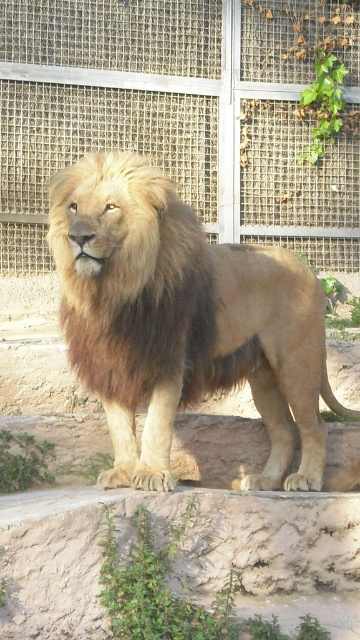
Question: Among these objects, which one is nearest to the camera?

Choices:
 (A) golden fur lion at center
 (B) metal mesh fence at upper center

Answer: (A)

Question: Does metal mesh fence at upper center have a larger size compared to golden fur lion at center?

Choices:
 (A) no
 (B) yes

Answer: (A)

Question: Can you confirm if metal mesh fence at upper center is positioned to the right of golden fur lion at center?

Choices:
 (A) yes
 (B) no

Answer: (B)

Question: Among these points, which one is nearest to the camera?

Choices:
 (A) (246, 92)
 (B) (312, 419)

Answer: (B)

Question: Does metal mesh fence at upper center appear on the left side of golden fur lion at center?

Choices:
 (A) yes
 (B) no

Answer: (A)

Question: Which point appears closest to the camera in this image?

Choices:
 (A) (144, 468)
 (B) (104, 35)

Answer: (A)